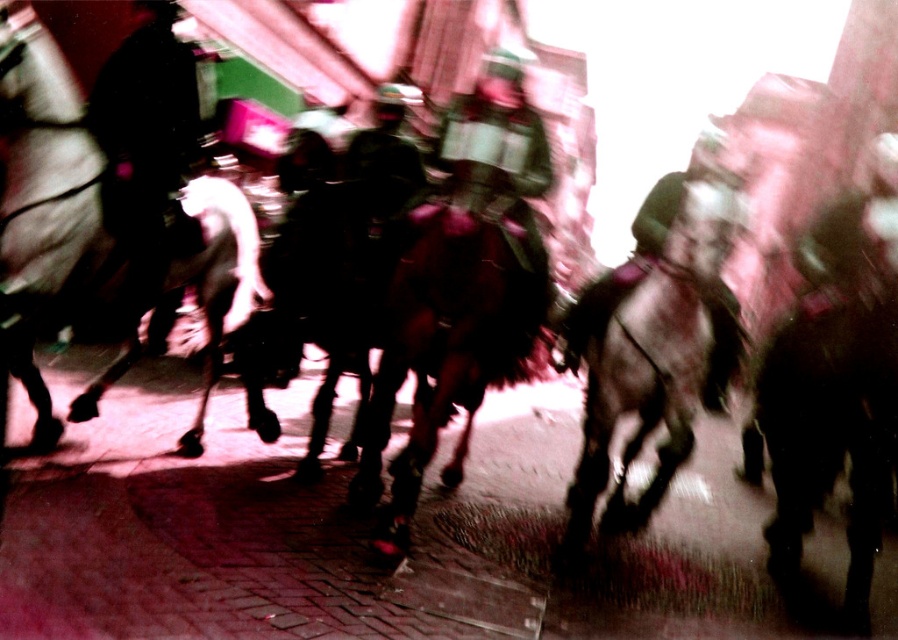
Can you confirm if white glossy horse at left is taller than shiny brown horse at center?

Yes, white glossy horse at left is taller than shiny brown horse at center.

Can you confirm if white glossy horse at left is thinner than shiny brown horse at center?

Yes.

Which is behind, point (60, 234) or point (368, 492)?

Positioned behind is point (368, 492).

Locate an element on the screen. white glossy horse at left is located at coordinates (116, 200).

Can you confirm if dark brown fur horse at center is shorter than shiny brown horse at center?

Incorrect, dark brown fur horse at center's height does not fall short of shiny brown horse at center's.

Who is shorter, dark brown fur horse at center or shiny brown horse at center?

shiny brown horse at center is shorter.

Is point (666, 451) positioned behind point (403, 477)?

Yes, it is behind point (403, 477).

The height and width of the screenshot is (640, 898). I want to click on dark brown fur horse at center, so click(x=649, y=355).

Looking at this image, is white glossy horse at left positioned at the back of dark brown fur at right?

No, white glossy horse at left is closer to the viewer.

Image resolution: width=898 pixels, height=640 pixels. In order to click on white glossy horse at left in this screenshot , I will do `click(116, 200)`.

Find the location of a particular element. The height and width of the screenshot is (640, 898). white glossy horse at left is located at coordinates (116, 200).